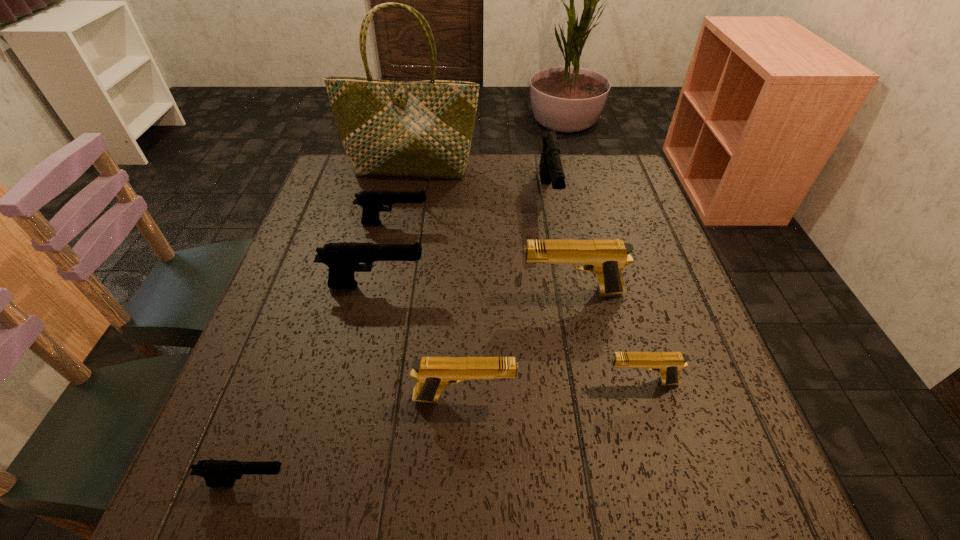
You are a GUI agent. You are given a task and a screenshot of the screen. Output one action in this format:
    pyautogui.click(x=<x>, y=<y>)
    Task: Click on the black pistol that is the closest one to the second nearest black pistol
    
    Given the screenshot: What is the action you would take?
    pyautogui.click(x=372, y=202)

Where is `the fourth closest black pistol to the fourth pistol from left to right`? the fourth closest black pistol to the fourth pistol from left to right is located at coordinates (551, 171).

Where is `tan pistol that is the closest to the nearest object`? This screenshot has width=960, height=540. tan pistol that is the closest to the nearest object is located at coordinates (433, 374).

The height and width of the screenshot is (540, 960). In order to click on tan pistol that stands as the second closest to the tallest object in this screenshot , I will do `click(433, 374)`.

I want to click on vacant space that satisfies the following two spatial constraints: 1. on the front-facing side of the biggest black pistol; 2. on the front-facing side of the nearest object, so click(x=601, y=483).